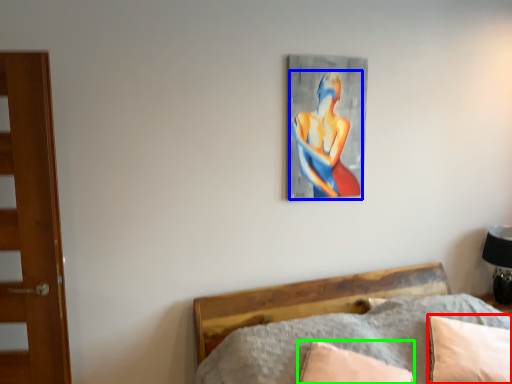
Question: Estimate the real-world distances between objects in this image. Which object is closer to pillow (highlighted by a red box), person (highlighted by a blue box) or pillow (highlighted by a green box)?

Choices:
 (A) person
 (B) pillow

Answer: (B)